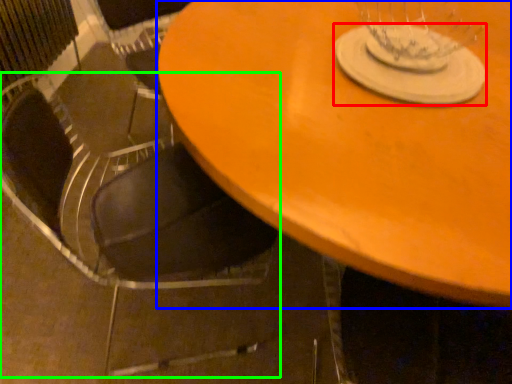
Question: Estimate the real-world distances between objects in this image. Which object is closer to glass plate (highlighted by a red box), table (highlighted by a blue box) or chair (highlighted by a green box)?

Choices:
 (A) table
 (B) chair

Answer: (A)